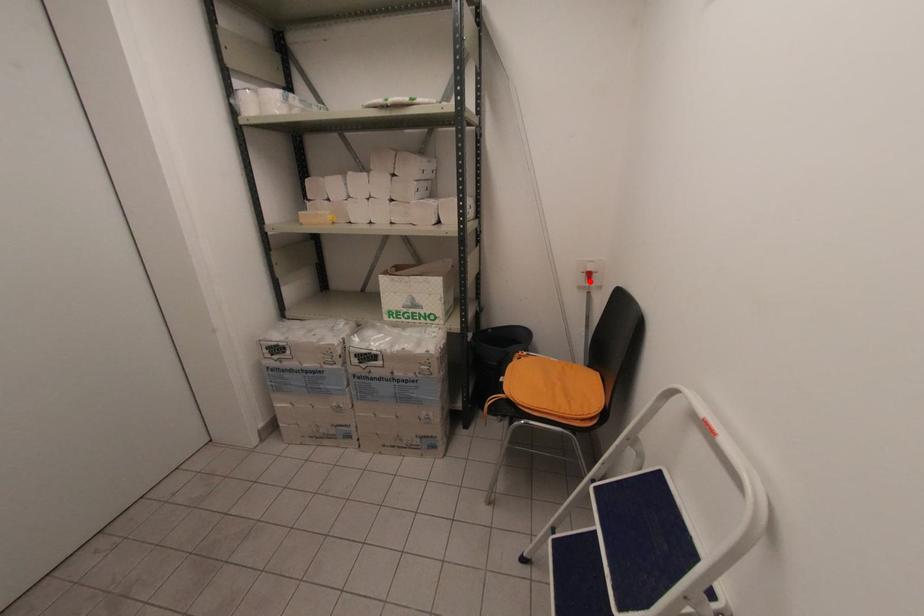
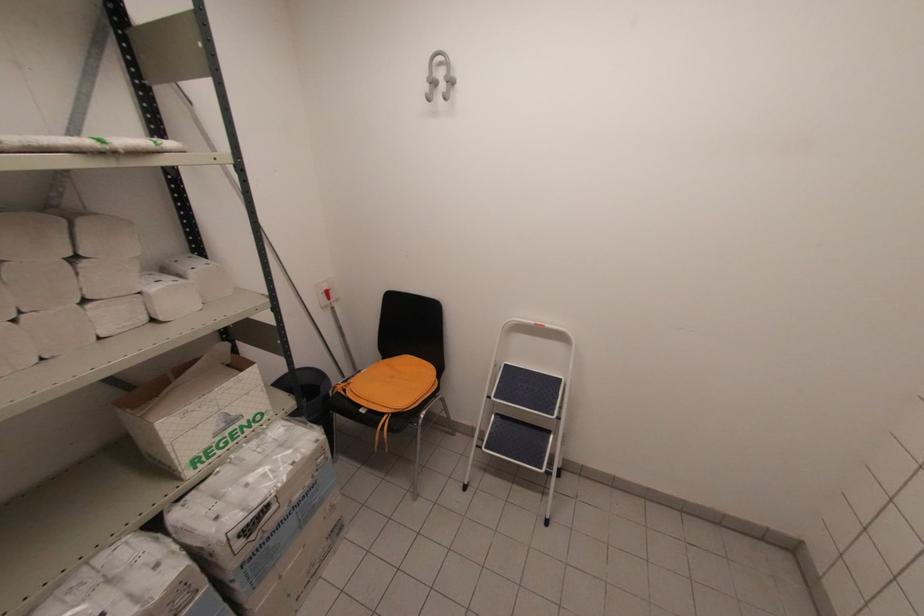
Where in the second image is the point corresponding to the highlighted location from the first image?

(330, 299)